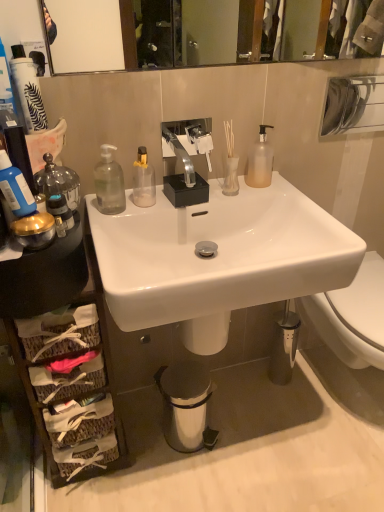
At what (x,y) coordinates should I click in order to perform the action: click on free space to the right of metallic trash can at lower center. Please return your answer as a coordinate pair (x, y). Looking at the image, I should click on (238, 430).